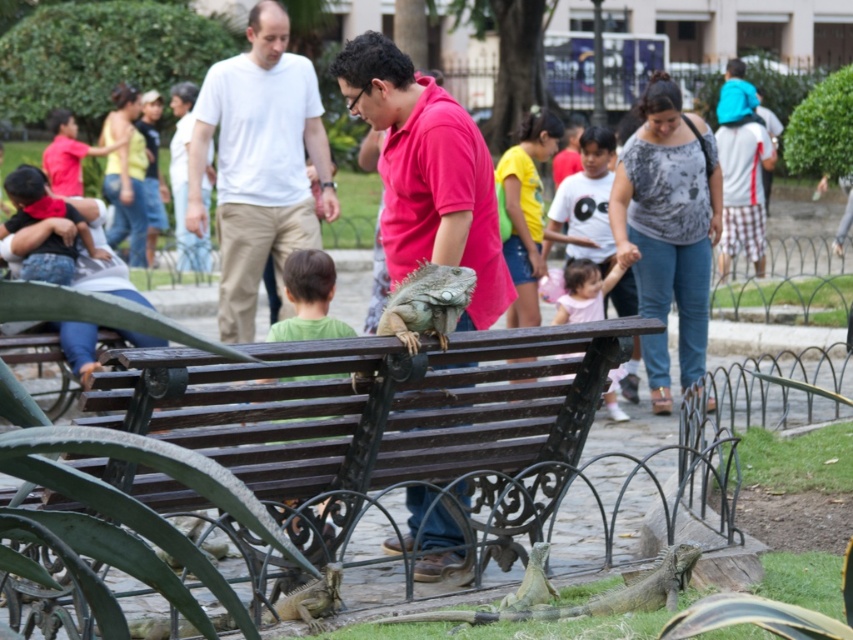
The image size is (853, 640). Identify the location of brown wooden bench at center. (376, 419).

What do you see at coordinates (376, 419) in the screenshot? This screenshot has height=640, width=853. I see `brown wooden bench at center` at bounding box center [376, 419].

At what (x,y) coordinates should I click in order to perform the action: click on brown wooden bench at center. Please return your answer as a coordinate pair (x, y). The height and width of the screenshot is (640, 853). Looking at the image, I should click on (376, 419).

At what (x,y) coordinates should I click in order to perform the action: click on brown wooden bench at center. Please return your answer as a coordinate pair (x, y). The height and width of the screenshot is (640, 853). Looking at the image, I should click on pos(376,419).

Who is more forward, (254,173) or (285,500)?

Point (285,500) is more forward.

In the scene shown: Is white cotton shirt at center taller than green matte shirt at center?

Yes.

Between point (247, 147) and point (312, 285), which one is positioned in front?

Point (312, 285) is more forward.

Where is `white cotton shirt at center`? The height and width of the screenshot is (640, 853). white cotton shirt at center is located at coordinates (258, 163).

Which is below, matte red shirt at center or pink fabric dress at center?

pink fabric dress at center is below.

Does matte red shirt at center have a larger size compared to pink fabric dress at center?

Indeed, matte red shirt at center has a larger size compared to pink fabric dress at center.

The width and height of the screenshot is (853, 640). What do you see at coordinates (427, 173) in the screenshot?
I see `matte red shirt at center` at bounding box center [427, 173].

Find the location of `matte red shirt at center`. matte red shirt at center is located at coordinates (427, 173).